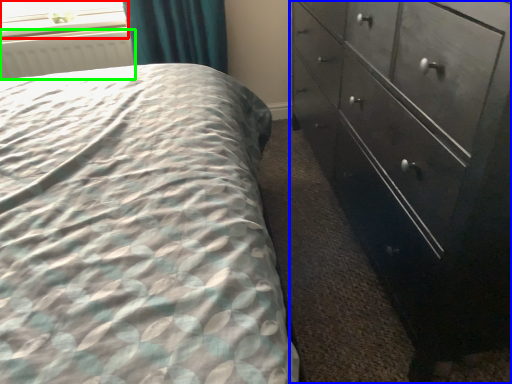
Question: Based on their relative distances, which object is farther from window screen (highlighted by a red box)? Choose from chest of drawers (highlighted by a blue box) and radiator (highlighted by a green box).

Choices:
 (A) chest of drawers
 (B) radiator

Answer: (A)